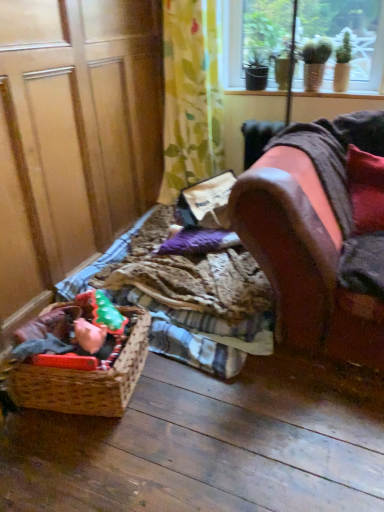
Describe the element at coordinates (186, 296) in the screenshot. I see `plaid fabric at lower left` at that location.

Locate an element on the screen. The image size is (384, 512). woven brown basket at lower left is located at coordinates (86, 380).

Measure the distance between green floral fabric at upper center and camera.

The distance of green floral fabric at upper center from camera is 2.04 meters.

Locate an element on the screen. green floral fabric at upper center is located at coordinates (191, 96).

Measure the distance between white painted wood at upper center and camera.

They are 7.12 feet apart.

I want to click on white painted wood at upper center, so click(338, 95).

At what (x,y) coordinates should I click in order to perform the action: click on plaid fabric at lower left. Please return your answer as a coordinate pair (x, y). The height and width of the screenshot is (512, 384). Looking at the image, I should click on (186, 296).

Who is shorter, plaid fabric at lower left or velvet red pillow at right?

With less height is plaid fabric at lower left.

Is plaid fabric at lower left inside the boundaries of velvet red pillow at right, or outside?

plaid fabric at lower left is outside velvet red pillow at right.

In the scene shown: Looking at the image, does plaid fabric at lower left seem bigger or smaller compared to velvet red pillow at right?

Considering their sizes, plaid fabric at lower left takes up more space than velvet red pillow at right.

Which object is thinner, plaid fabric at lower left or velvet red pillow at right?

velvet red pillow at right.

Which is more to the left, green floral fabric at upper center or plaid fabric at lower left?

From the viewer's perspective, green floral fabric at upper center appears more on the left side.

Relative to plaid fabric at lower left, is green floral fabric at upper center in front or behind?

Visually, green floral fabric at upper center is located behind plaid fabric at lower left.

Locate an element on the screen. The width and height of the screenshot is (384, 512). curtain that appears behind the plaid fabric at lower left is located at coordinates (191, 96).

Is white painted wood at upper center at the right side of velvet red pillow at right?

No, white painted wood at upper center is not to the right of velvet red pillow at right.

In terms of size, does white painted wood at upper center appear bigger or smaller than velvet red pillow at right?

Clearly, white painted wood at upper center is smaller in size than velvet red pillow at right.

Could you tell me if white painted wood at upper center is turned towards velvet red pillow at right?

No, white painted wood at upper center is not oriented towards velvet red pillow at right.

Can you confirm if white painted wood at upper center is taller than velvet red pillow at right?

No.

Looking at this image, is green floral fabric at upper center positioned far away from white painted wood at upper center?

Actually, green floral fabric at upper center and white painted wood at upper center are a little close together.

Could white painted wood at upper center be considered to be inside green floral fabric at upper center?

That's incorrect, white painted wood at upper center is not inside green floral fabric at upper center.

Looking at this image, how many degrees apart are the facing directions of green floral fabric at upper center and white painted wood at upper center?

1.49 degrees.

Considering the relative positions of green floral fabric at upper center and white painted wood at upper center in the image provided, is green floral fabric at upper center to the left or to the right of white painted wood at upper center?

Based on their positions, green floral fabric at upper center is located to the left of white painted wood at upper center.

Is matte red toy at lower left further to camera compared to velvet red pillow at right?

No, matte red toy at lower left is closer to the camera.

In the scene shown: Between matte red toy at lower left and velvet red pillow at right, which one has smaller size?

Smaller between the two is matte red toy at lower left.

Which point is more distant from viewer, (122, 329) or (368, 228)?

The point (368, 228) is farther from the camera.

Can you tell me how much matte red toy at lower left and velvet red pillow at right differ in facing direction?

The facing directions of matte red toy at lower left and velvet red pillow at right are 94.3 degrees apart.

Relative to wooden screen door at lower left, is matte red toy at lower left in front or behind?

matte red toy at lower left is positioned farther from the viewer than wooden screen door at lower left.

Between matte red toy at lower left and wooden screen door at lower left, which one appears on the right side from the viewer's perspective?

matte red toy at lower left is more to the right.

Find the location of a particular element. This screenshot has width=384, height=512. screen door that is above the matte red toy at lower left (from the image's perspective) is located at coordinates (74, 137).

From the image's perspective, which is below, wooden screen door at lower left or woven brown basket at lower left?

woven brown basket at lower left, from the image's perspective.

Who is shorter, wooden screen door at lower left or woven brown basket at lower left?

woven brown basket at lower left.

Is woven brown basket at lower left surrounded by wooden screen door at lower left?

No, wooden screen door at lower left does not contain woven brown basket at lower left.

How many degrees apart are the facing directions of wooden screen door at lower left and woven brown basket at lower left?

The angular difference between wooden screen door at lower left and woven brown basket at lower left is 14.2 degrees.

The image size is (384, 512). Find the location of `bedding below the velvet red pillow at right (from the image's perspective)`. bedding below the velvet red pillow at right (from the image's perspective) is located at coordinates (186, 296).

At what (x,y) coordinates should I click in order to perform the action: click on curtain behind the plaid fabric at lower left. Please return your answer as a coordinate pair (x, y). The height and width of the screenshot is (512, 384). Looking at the image, I should click on (191, 96).

From the image, which object appears to be nearer to matte red toy at lower left, wooden screen door at lower left or leather couch at right?

Based on the image, wooden screen door at lower left appears to be nearer to matte red toy at lower left.

Considering their positions, is woven brown basket at lower left positioned further to leather couch at right than white painted wood at upper center?

white painted wood at upper center is positioned further to the anchor leather couch at right.

When comparing their distances from plaid fabric at lower left, does velvet red pillow at right or matte red toy at lower left seem further?

velvet red pillow at right is positioned further to the anchor plaid fabric at lower left.

Looking at this image, estimate the real-world distances between objects in this image. Which object is closer to plaid fabric at lower left, velvet red pillow at right or green floral fabric at upper center?

velvet red pillow at right.

Which object lies nearer to the anchor point wooden screen door at lower left, leather couch at right or matte red toy at lower left?

matte red toy at lower left is closer to wooden screen door at lower left.

When comparing their distances from matte red toy at lower left, does velvet red pillow at right or wooden screen door at lower left seem further?

velvet red pillow at right lies further to matte red toy at lower left than the other object.

From the image, which object appears to be nearer to velvet red pillow at right, woven brown basket at lower left or white painted wood at upper center?

Among the two, white painted wood at upper center is located nearer to velvet red pillow at right.

From the image, which object appears to be nearer to woven brown basket at lower left, matte red toy at lower left or leather couch at right?

matte red toy at lower left lies closer to woven brown basket at lower left than the other object.

You are a GUI agent. You are given a task and a screenshot of the screen. Output one action in this format:
    pyautogui.click(x=<x>, y=<y>)
    Task: Click on the bedding that lies between white painted wood at upper center and matte red toy at lower left from top to bottom
    The image size is (384, 512).
    Given the screenshot: What is the action you would take?
    pyautogui.click(x=186, y=296)

This screenshot has height=512, width=384. Find the location of `studio couch situated between green floral fabric at upper center and velvet red pillow at right from left to right`. studio couch situated between green floral fabric at upper center and velvet red pillow at right from left to right is located at coordinates (321, 234).

Identify the location of studio couch between green floral fabric at upper center and plaid fabric at lower left in the vertical direction. The height and width of the screenshot is (512, 384). (321, 234).

You are a GUI agent. You are given a task and a screenshot of the screen. Output one action in this format:
    pyautogui.click(x=<x>, y=<y>)
    Task: Click on the studio couch that lies between white painted wood at upper center and woven brown basket at lower left from top to bottom
    
    Given the screenshot: What is the action you would take?
    [x=321, y=234]